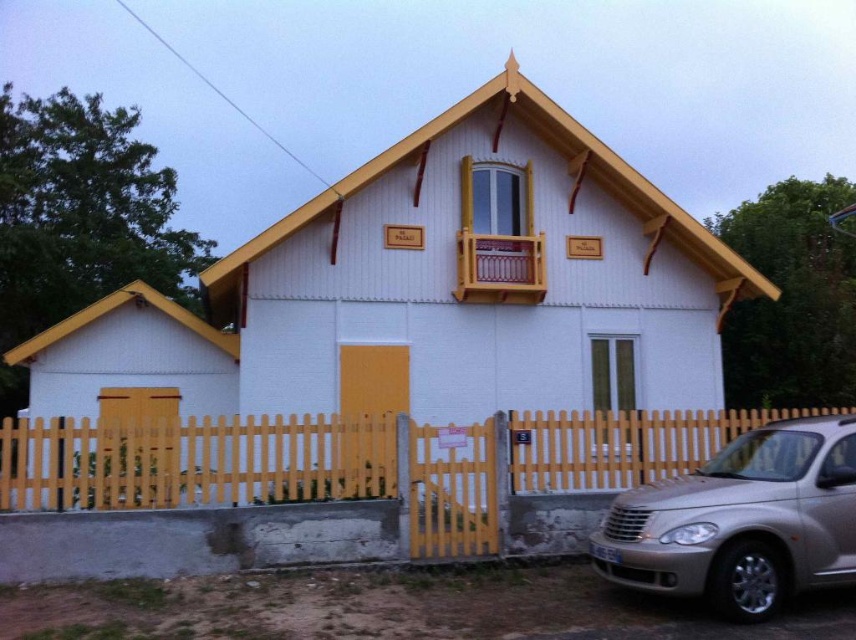
The height and width of the screenshot is (640, 856). What do you see at coordinates (194, 461) in the screenshot? I see `yellow wooden fence at lower center` at bounding box center [194, 461].

Is yellow wooden fence at lower center wider than silver metallic car at lower right?

Incorrect, yellow wooden fence at lower center's width does not surpass silver metallic car at lower right's.

Find the location of a particular element. yellow wooden fence at lower center is located at coordinates (194, 461).